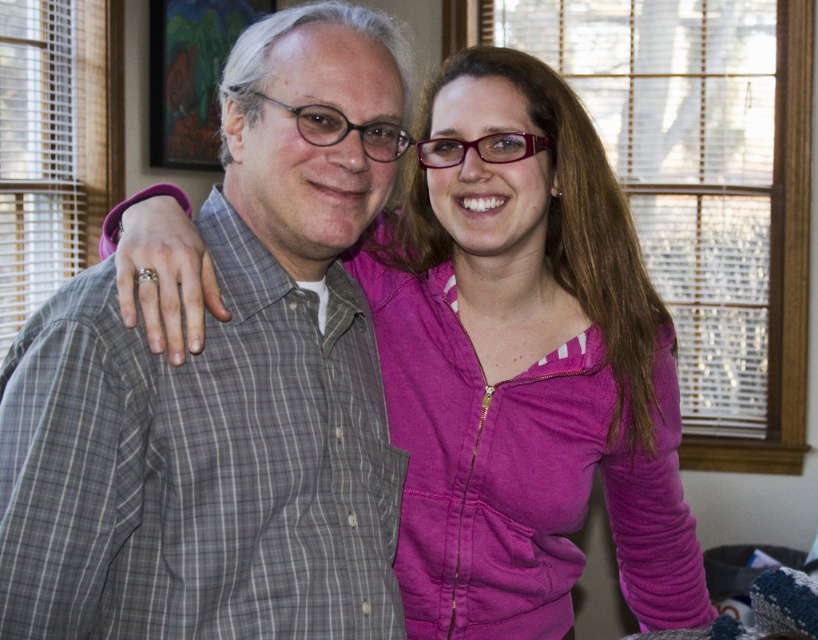
Can you confirm if gray plaid shirt at center is positioned above purple zip-up hoodie at center?

Correct, gray plaid shirt at center is located above purple zip-up hoodie at center.

Is gray plaid shirt at center wider than purple zip-up hoodie at center?

No, gray plaid shirt at center is not wider than purple zip-up hoodie at center.

At what (x,y) coordinates should I click in order to perform the action: click on gray plaid shirt at center. Please return your answer as a coordinate pair (x, y). Looking at the image, I should click on (225, 387).

This screenshot has height=640, width=818. Find the location of `gray plaid shirt at center`. gray plaid shirt at center is located at coordinates (225, 387).